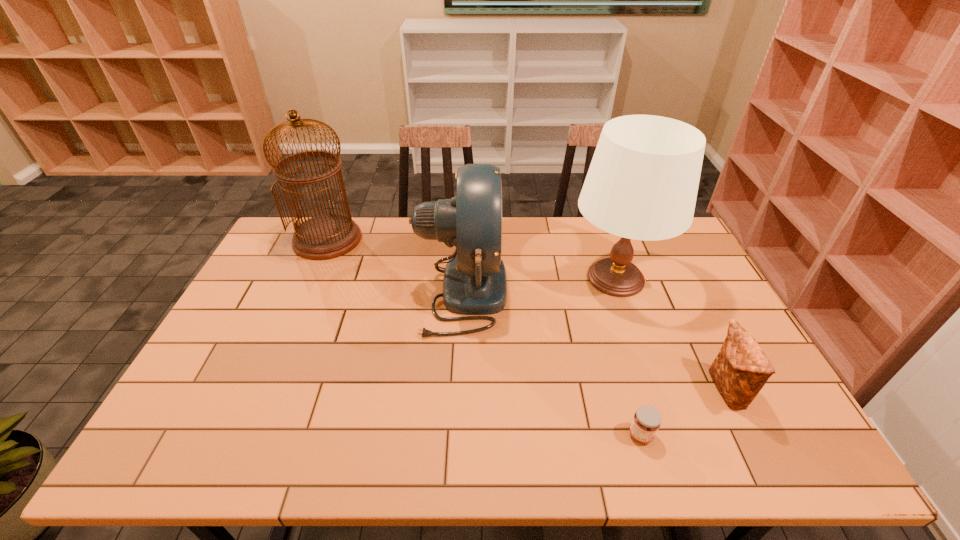
Where is `vacant area that lies between the jam and the leftmost object`? The image size is (960, 540). vacant area that lies between the jam and the leftmost object is located at coordinates (484, 337).

The width and height of the screenshot is (960, 540). What are the coordinates of `unoccupied area between the fourth tallest object and the lamp` in the screenshot? It's located at (671, 334).

In order to click on free space between the nearest object and the clutch bag in this screenshot , I will do 684,413.

The width and height of the screenshot is (960, 540). What are the coordinates of `empty location between the fourth tallest object and the lamp` in the screenshot? It's located at (671, 334).

Where is `free point between the shortest object and the lamp`? The width and height of the screenshot is (960, 540). free point between the shortest object and the lamp is located at coordinates (629, 356).

Identify the location of blank region between the clutch bag and the lamp. (671, 334).

Where is `free space between the second object from left to right and the clutch bag`? free space between the second object from left to right and the clutch bag is located at coordinates (593, 341).

Locate an element on the screen. This screenshot has height=540, width=960. free spot between the lamp and the clutch bag is located at coordinates (671, 334).

Find the location of a particular element. This screenshot has height=540, width=960. empty location between the shortest object and the fourth farthest object is located at coordinates coord(684,413).

Identify which object is the second closest to the birdcage. Please provide its 2D coordinates. Your answer should be formatted as a tuple, i.e. [(x, y)], where the tuple contains the x and y coordinates of a point satisfying the conditions above.

[(642, 183)]